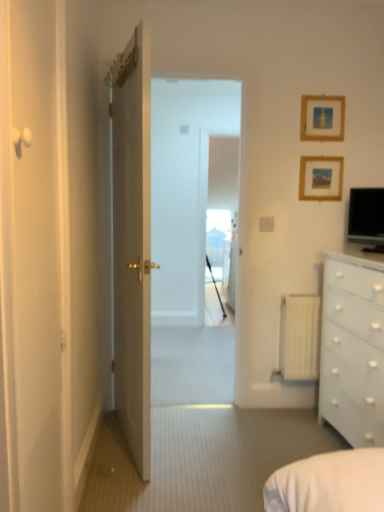
Question: Looking at their shapes, would you say transparent glass window at center is wider or thinner than wooden picture frame at upper right, the 1th picture frame positioned from the top?

Choices:
 (A) thin
 (B) wide

Answer: (B)

Question: In the image, is transparent glass window at center on the left side or the right side of wooden picture frame at upper right, the 2th picture frame in the bottom-to-top sequence?

Choices:
 (A) right
 (B) left

Answer: (B)

Question: Based on their relative distances, which object is nearer to the white glossy door at left, the first door positioned from the front?

Choices:
 (A) wooden picture frame at upper right, which is counted as the 1th picture frame, starting from the bottom
 (B) black glossy monitor at upper right
 (C) wooden picture frame at upper right, the 2th picture frame in the bottom-to-top sequence
 (D) transparent glass window at center
 (E) white matte radiator at right

Answer: (E)

Question: Which is farther from the wooden picture frame at upper right, the 2th picture frame in the bottom-to-top sequence?

Choices:
 (A) white glossy door at center, placed as the second door when sorted from front to back
 (B) white glossy chest of drawers at right
 (C) white glossy door at left, the first door positioned from the front
 (D) white matte radiator at right
 (E) transparent glass window at center

Answer: (E)